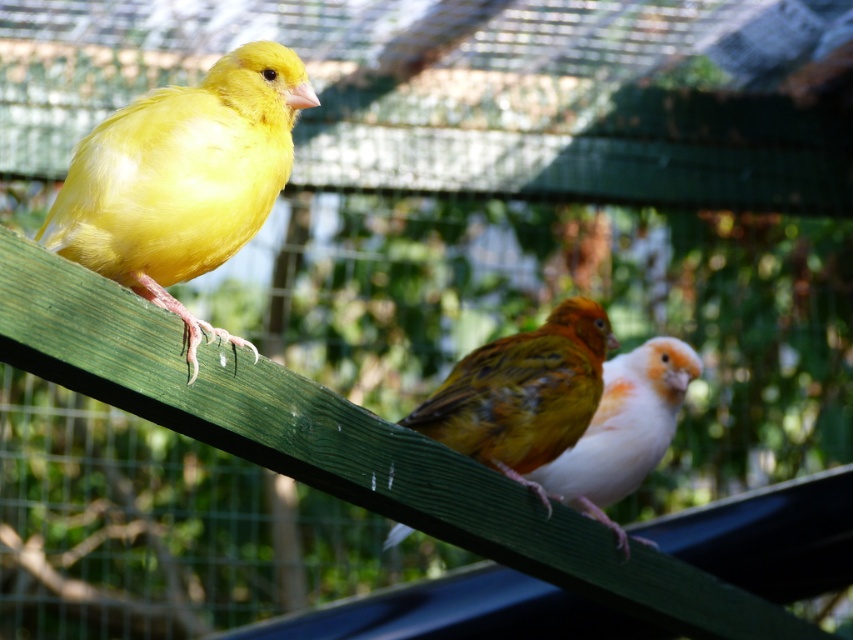
Question: Estimate the real-world distances between objects in this image. Which object is closer to the orange-brown speckled bird at center?

Choices:
 (A) matte yellow canary at left
 (B) white feathered bird at center

Answer: (B)

Question: Can you confirm if orange-brown speckled bird at center is positioned to the right of white feathered bird at center?

Choices:
 (A) yes
 (B) no

Answer: (B)

Question: Can you confirm if matte yellow canary at left is positioned above orange-brown speckled bird at center?

Choices:
 (A) no
 (B) yes

Answer: (B)

Question: Is matte yellow canary at left further to the viewer compared to orange-brown speckled bird at center?

Choices:
 (A) yes
 (B) no

Answer: (B)

Question: Which point is closer to the camera taking this photo?

Choices:
 (A) (523, 333)
 (B) (643, 433)
 (C) (192, 93)

Answer: (C)

Question: Which object is the farthest from the white feathered bird at center?

Choices:
 (A) orange-brown speckled bird at center
 (B) matte yellow canary at left

Answer: (B)